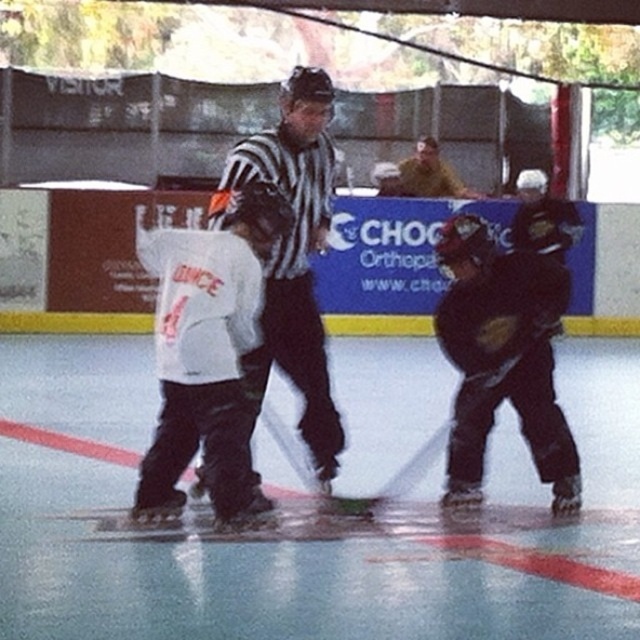
Is white jersey at center shorter than black striped shirt at center?

Indeed, white jersey at center has a lesser height compared to black striped shirt at center.

Can you confirm if white jersey at center is positioned to the left of black striped shirt at center?

Correct, you'll find white jersey at center to the left of black striped shirt at center.

Is point (230, 360) farther from viewer compared to point (292, 301)?

No.

Find the location of a particular element. This screenshot has width=640, height=640. white jersey at center is located at coordinates (209, 356).

Which of these two, black matte hockey helmet at center or black matte hockey stick at center, stands taller?

black matte hockey helmet at center

Is black matte hockey helmet at center to the right of black matte hockey stick at center from the viewer's perspective?

Correct, you'll find black matte hockey helmet at center to the right of black matte hockey stick at center.

Between point (522, 428) and point (326, 506), which one is positioned in front?

Point (326, 506) is more forward.

Locate an element on the screen. The image size is (640, 640). black matte hockey helmet at center is located at coordinates (502, 356).

Does white jersey at center have a greater height compared to black matte hockey stick at center?

Correct, white jersey at center is much taller as black matte hockey stick at center.

Who is positioned more to the right, white jersey at center or black matte hockey stick at center?

black matte hockey stick at center

Image resolution: width=640 pixels, height=640 pixels. Describe the element at coordinates (209, 356) in the screenshot. I see `white jersey at center` at that location.

The width and height of the screenshot is (640, 640). In order to click on white jersey at center in this screenshot , I will do `click(209, 356)`.